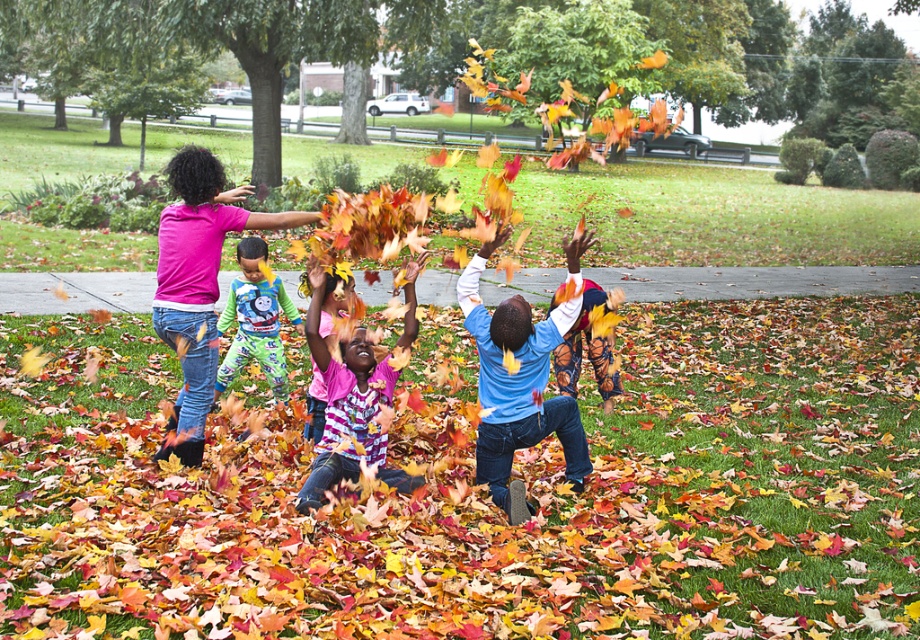
Can you confirm if matte pink shirt at upper left is positioned to the left of thomas the tank engine pajamas at center?

Yes, matte pink shirt at upper left is to the left of thomas the tank engine pajamas at center.

Who is lower down, matte pink shirt at upper left or thomas the tank engine pajamas at center?

thomas the tank engine pajamas at center is below.

Between point (180, 232) and point (246, 328), which one is positioned in front?

Positioned in front is point (180, 232).

I want to click on matte pink shirt at upper left, so click(x=198, y=280).

Image resolution: width=920 pixels, height=640 pixels. I want to click on matte pink shirt at upper left, so click(198, 280).

Can you confirm if matte pink shirt at upper left is positioned to the left of matte pink shirt at center?

Correct, you'll find matte pink shirt at upper left to the left of matte pink shirt at center.

Is point (210, 376) positioned in front of point (351, 376)?

No, (210, 376) is further to viewer.

Where is `matte pink shirt at upper left`? The height and width of the screenshot is (640, 920). matte pink shirt at upper left is located at coordinates (198, 280).

Does blue fleece sweatshirt at center appear on the right side of matte pink shirt at center?

Yes, blue fleece sweatshirt at center is to the right of matte pink shirt at center.

Where is `blue fleece sweatshirt at center`? This screenshot has height=640, width=920. blue fleece sweatshirt at center is located at coordinates (518, 387).

What do you see at coordinates (518, 387) in the screenshot? I see `blue fleece sweatshirt at center` at bounding box center [518, 387].

You are a GUI agent. You are given a task and a screenshot of the screen. Output one action in this format:
    pyautogui.click(x=<x>, y=<y>)
    Task: Click on the blue fleece sweatshirt at center
    The width and height of the screenshot is (920, 640).
    Given the screenshot: What is the action you would take?
    pyautogui.click(x=518, y=387)